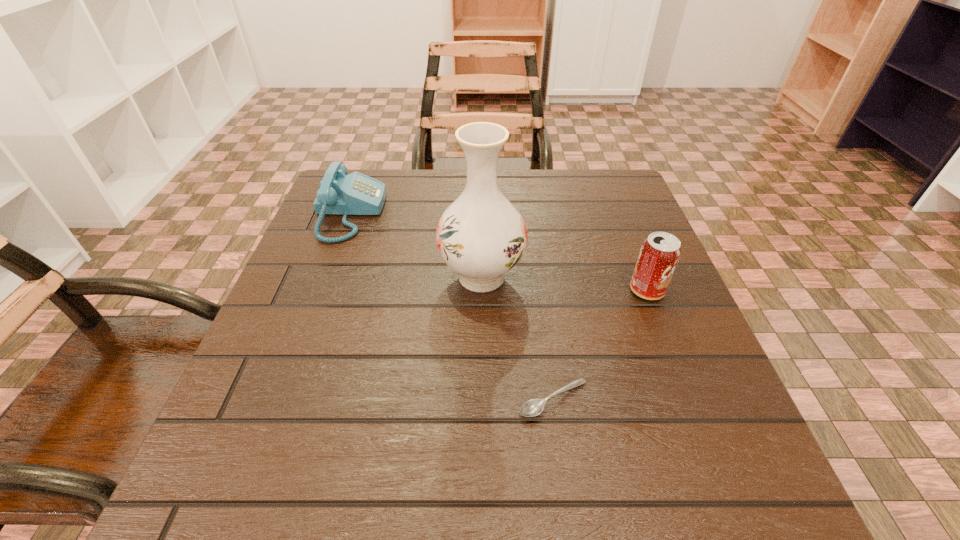
The width and height of the screenshot is (960, 540). Find the location of `vacant space located 0.350m on the back of the nearest object`. vacant space located 0.350m on the back of the nearest object is located at coordinates tap(533, 244).

The height and width of the screenshot is (540, 960). Identify the location of object present at the far edge. (339, 193).

Locate an element on the screen. The height and width of the screenshot is (540, 960). object that is at the left edge is located at coordinates (339, 193).

Where is `object located at the right edge`? object located at the right edge is located at coordinates (659, 255).

Where is `object that is at the far left corner`? This screenshot has height=540, width=960. object that is at the far left corner is located at coordinates (339, 193).

Where is `vacant space at the far edge`? vacant space at the far edge is located at coordinates (425, 169).

The height and width of the screenshot is (540, 960). I want to click on blank space at the left edge of the desktop, so click(334, 319).

Identify the location of vacant space at the right edge. coord(644,347).

The image size is (960, 540). In order to click on vacant space at the near left corner of the desktop in this screenshot , I will do `click(213, 492)`.

In the image, there is a desktop. At what (x,y) coordinates should I click in order to perform the action: click on vacant area at the far right corner. Please return your answer as a coordinate pair (x, y). Looking at the image, I should click on (571, 181).